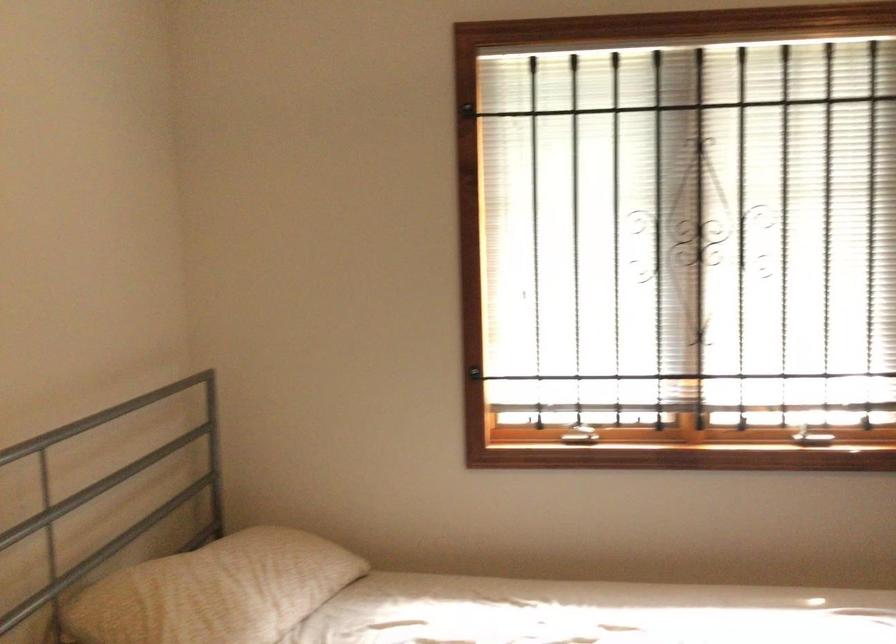
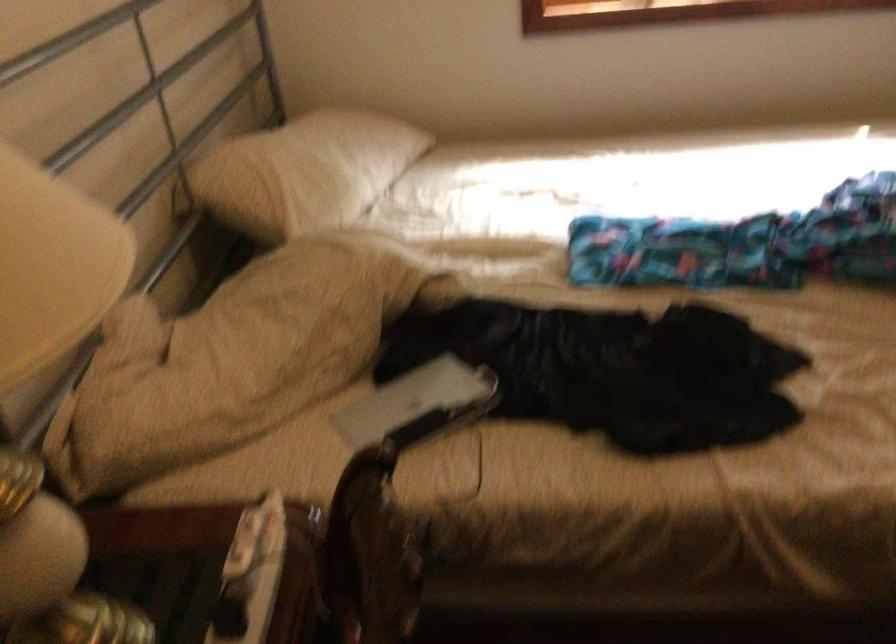
Question: Based on the continuous images, in which direction is the camera rotating? Reply with the corresponding letter.

Choices:
 (A) Left
 (B) Right
 (C) Up
 (D) Down

Answer: (D)